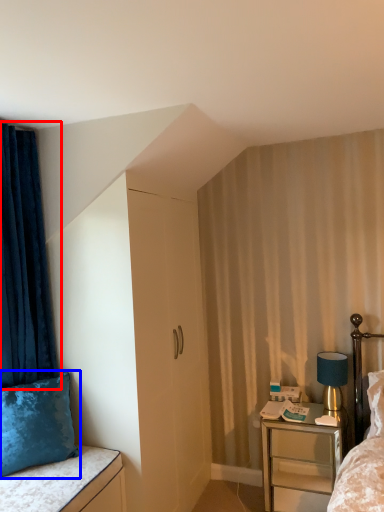
Question: Among these objects, which one is nearest to the camera, curtain (highlighted by a red box) or pillow (highlighted by a blue box)?

Choices:
 (A) curtain
 (B) pillow

Answer: (B)